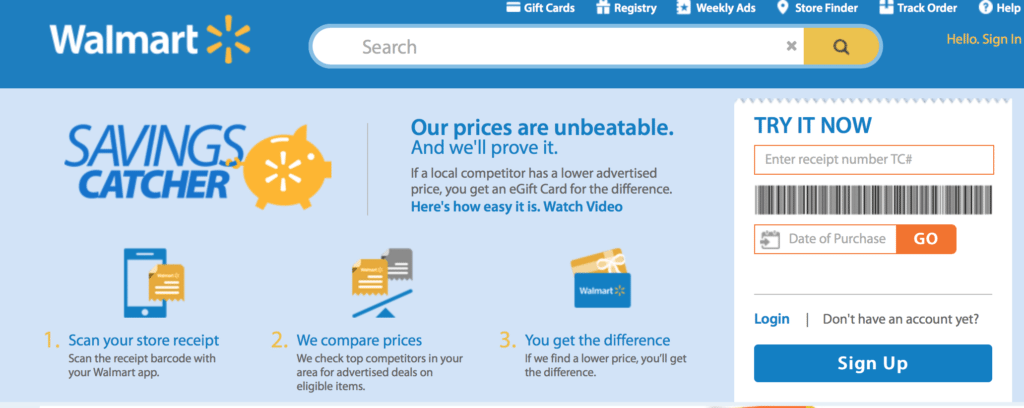
Find the location of a particular element. Image resolution: width=1024 pixels, height=408 pixels. present ribbon is located at coordinates (603, 262).